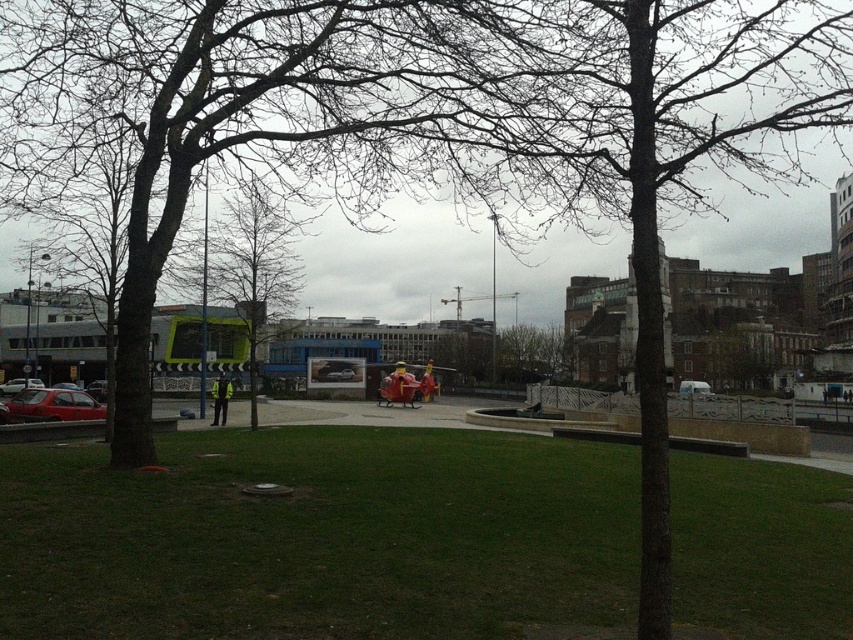
Question: Considering the relative positions of matte red car at lower left and high visibility yellow jacket at center in the image provided, where is matte red car at lower left located with respect to high visibility yellow jacket at center?

Choices:
 (A) right
 (B) left

Answer: (B)

Question: Observing the image, what is the correct spatial positioning of matte red car at lower left in reference to high visibility yellow jacket at center?

Choices:
 (A) below
 (B) above

Answer: (B)

Question: Considering the relative positions of green grass at center and matte red car at lower left in the image provided, where is green grass at center located with respect to matte red car at lower left?

Choices:
 (A) below
 (B) above

Answer: (B)

Question: Which of the following is the farthest from the observer?

Choices:
 (A) matte red car at lower left
 (B) white matte van at center
 (C) high visibility yellow jacket at center

Answer: (B)

Question: Which point is closer to the camera taking this photo?

Choices:
 (A) click(18, 417)
 (B) click(221, 394)
 (C) click(683, 392)
 (D) click(495, 445)

Answer: (D)

Question: Which is nearer to the green grass at center?

Choices:
 (A) matte red car at lower left
 (B) high visibility yellow jacket at center
 (C) white matte van at center

Answer: (A)